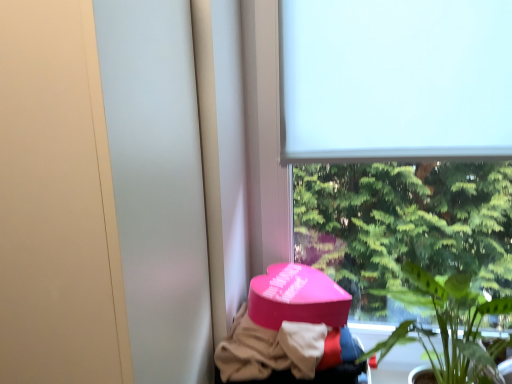
Question: Can you confirm if green leafy plant at lower right is shorter than white matte window screen at upper center?

Choices:
 (A) no
 (B) yes

Answer: (A)

Question: Can you confirm if green leafy plant at lower right is wider than white matte window screen at upper center?

Choices:
 (A) yes
 (B) no

Answer: (A)

Question: Is the position of green leafy plant at lower right less distant than that of white matte window screen at upper center?

Choices:
 (A) no
 (B) yes

Answer: (B)

Question: Is the surface of green leafy plant at lower right in direct contact with white matte window screen at upper center?

Choices:
 (A) no
 (B) yes

Answer: (A)

Question: From the image's perspective, is green leafy plant at lower right above white matte window screen at upper center?

Choices:
 (A) no
 (B) yes

Answer: (A)

Question: Is green leafy plant at lower right oriented towards white matte window screen at upper center?

Choices:
 (A) yes
 (B) no

Answer: (B)

Question: Is the depth of pink matte heart-shaped box at lower center greater than that of white matte window at upper center?

Choices:
 (A) yes
 (B) no

Answer: (B)

Question: Is pink matte heart-shaped box at lower center next to white matte window at upper center and touching it?

Choices:
 (A) no
 (B) yes

Answer: (A)

Question: Is pink matte heart-shaped box at lower center surrounding white matte window at upper center?

Choices:
 (A) yes
 (B) no

Answer: (B)

Question: From the image's perspective, is pink matte heart-shaped box at lower center on white matte window at upper center?

Choices:
 (A) no
 (B) yes

Answer: (A)

Question: Can you confirm if pink matte heart-shaped box at lower center is shorter than white matte window at upper center?

Choices:
 (A) no
 (B) yes

Answer: (B)

Question: From the image's perspective, does pink matte heart-shaped box at lower center appear lower than white matte window at upper center?

Choices:
 (A) no
 (B) yes

Answer: (B)

Question: Is green leafy plant at lower right at the left side of pink matte heart-shaped box at lower center?

Choices:
 (A) yes
 (B) no

Answer: (B)